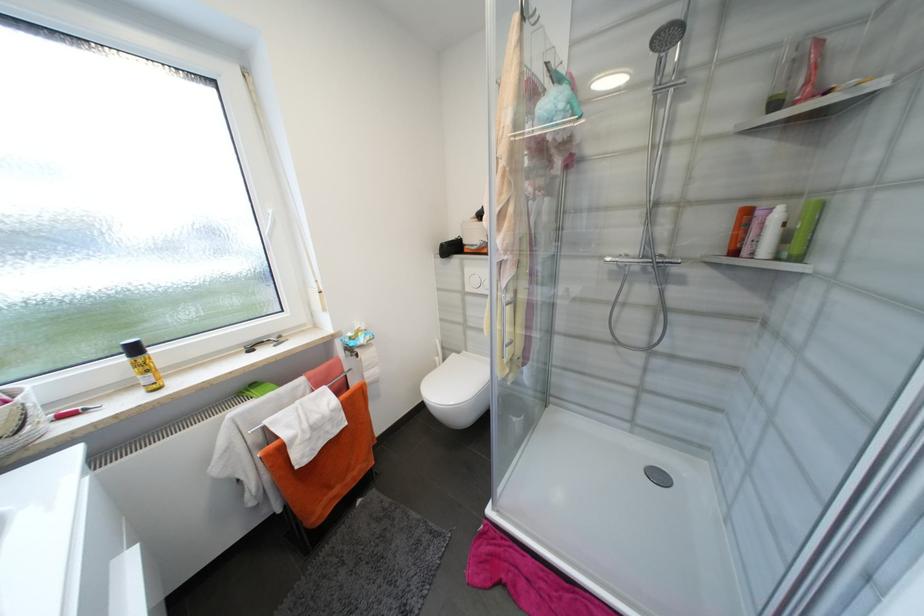
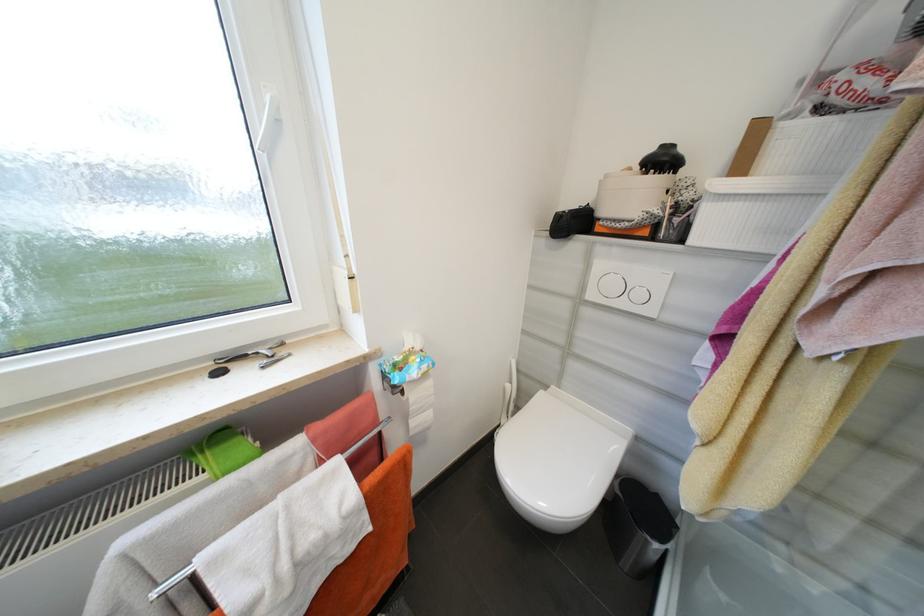
The point at (362, 357) is marked in the first image. Where is the corresponding point in the second image?

(407, 392)